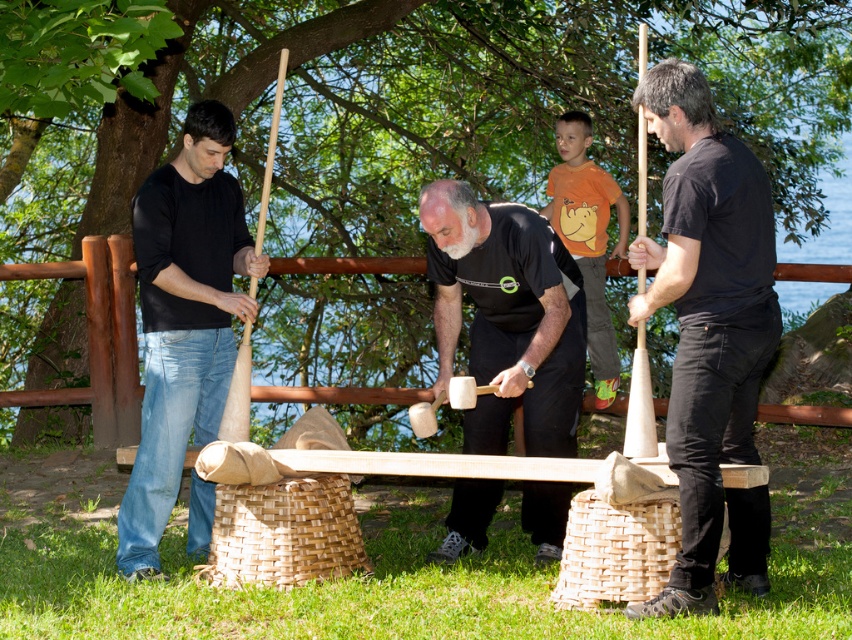
Does black matte shirt at right have a greater width compared to matte black shirt at left?

In fact, black matte shirt at right might be narrower than matte black shirt at left.

Who is shorter, black matte shirt at right or matte black shirt at left?

black matte shirt at right

Which is behind, point (707, 154) or point (160, 432)?

Point (160, 432)

You are a GUI agent. You are given a task and a screenshot of the screen. Output one action in this format:
    pyautogui.click(x=<x>, y=<y>)
    Task: Click on the black matte shirt at right
    
    Given the screenshot: What is the action you would take?
    pyautogui.click(x=709, y=332)

Who is positioned more to the left, black matte shirt at right or smooth wooden mallets at center?

Positioned to the left is smooth wooden mallets at center.

Find the location of `black matte shirt at right`. black matte shirt at right is located at coordinates (709, 332).

The width and height of the screenshot is (852, 640). In order to click on black matte shirt at right in this screenshot , I will do `click(709, 332)`.

Measure the distance from smooth wooden mallets at center to matte black shirt at left.

The distance of smooth wooden mallets at center from matte black shirt at left is 5.43 feet.

Which is in front, point (476, 433) or point (137, 576)?

Point (137, 576) is more forward.

At what (x,y) coordinates should I click in order to perform the action: click on smooth wooden mallets at center. Please return your answer as a coordinate pair (x, y). The width and height of the screenshot is (852, 640). Looking at the image, I should click on (507, 316).